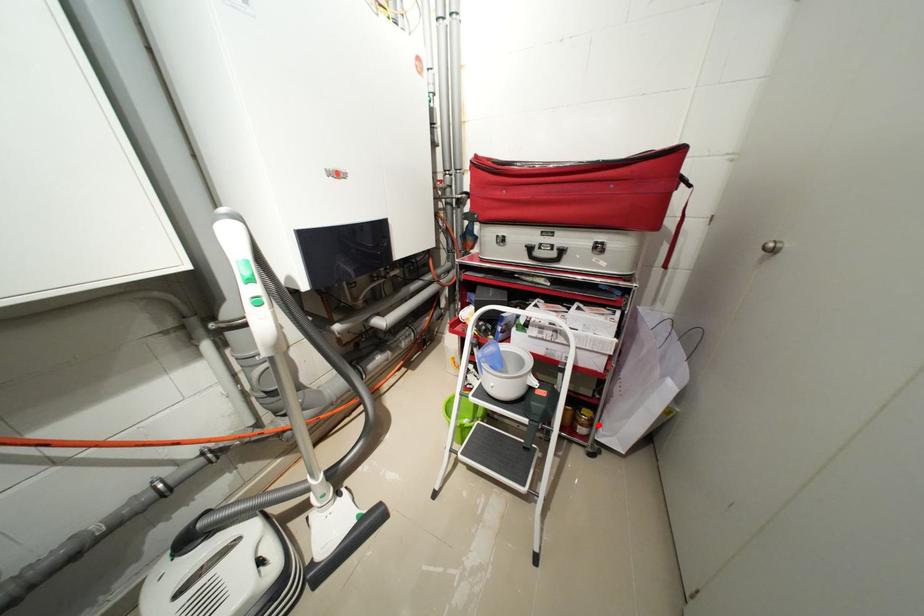
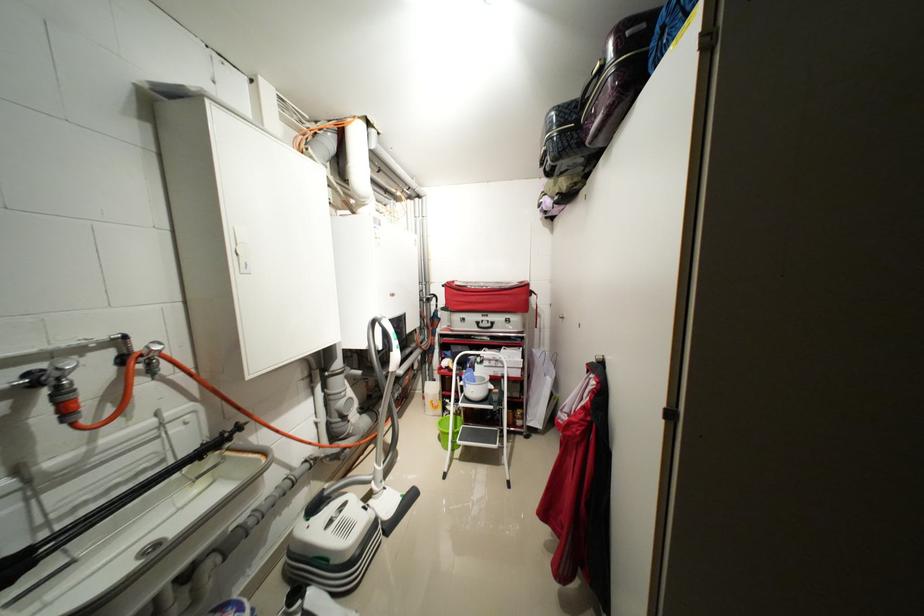
Find the pixel in the second image that matches the highlighted location in the first image.

(530, 418)